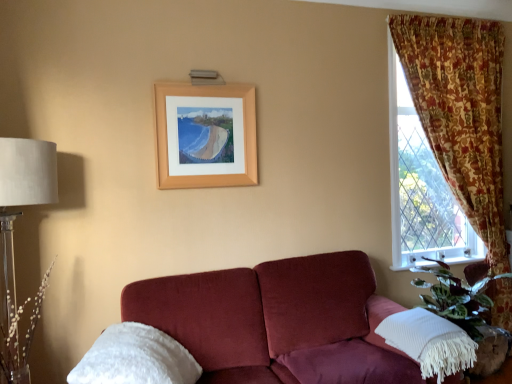
What is the approximate height of white textured pillow at lower right, arranged as the 2th pillow when viewed from the left?

It is 32.26 centimeters.

Locate an element on the screen. green leafy plant at lower right is located at coordinates (459, 294).

The width and height of the screenshot is (512, 384). Describe the element at coordinates (12, 237) in the screenshot. I see `translucent glass table lamp at left` at that location.

The width and height of the screenshot is (512, 384). What are the coordinates of `white textured pillow at lower right, arranged as the 2th pillow when viewed from the left` in the screenshot? It's located at (429, 342).

Is translucent glass table lamp at left beside green leafy plant at lower right?

No, translucent glass table lamp at left is not touching green leafy plant at lower right.

How many degrees apart are the facing directions of translucent glass table lamp at left and green leafy plant at lower right?

The angular difference between translucent glass table lamp at left and green leafy plant at lower right is 3.39 degrees.

Between translucent glass table lamp at left and green leafy plant at lower right, which one has larger width?

Wider between the two is green leafy plant at lower right.

Between translucent glass table lamp at left and green leafy plant at lower right, which one appears on the left side from the viewer's perspective?

translucent glass table lamp at left is more to the left.

Which is closer to the camera, (129, 330) or (398, 263)?

Point (129, 330) appears to be closer to the viewer than point (398, 263).

Is white fluffy pillow at lower left, which appears as the 1th pillow when viewed from the left, not inside white plastic at lower right?

Indeed, white fluffy pillow at lower left, which appears as the 1th pillow when viewed from the left, is completely outside white plastic at lower right.

Considering the sizes of objects white fluffy pillow at lower left, marked as the 2th pillow in a right-to-left arrangement, and white plastic at lower right in the image provided, who is smaller, white fluffy pillow at lower left, marked as the 2th pillow in a right-to-left arrangement, or white plastic at lower right?

With smaller size is white plastic at lower right.

From the image's perspective, which one is positioned lower, white fluffy pillow at lower left, which appears as the 1th pillow when viewed from the left, or white plastic at lower right?

From the image's view, white fluffy pillow at lower left, which appears as the 1th pillow when viewed from the left, is below.

Is white plastic at lower right smaller than floral fabric curtain at right?

Yes.

Where is `window sill located behind the floral fabric curtain at right`? The height and width of the screenshot is (384, 512). window sill located behind the floral fabric curtain at right is located at coordinates (437, 257).

Is white plastic at lower right closer to the viewer compared to floral fabric curtain at right?

No, white plastic at lower right is further to the viewer.

Does white plastic at lower right have a lesser width compared to floral fabric curtain at right?

Yes, white plastic at lower right is thinner than floral fabric curtain at right.

Who is bigger, translucent glass table lamp at left or white textured pillow at lower right, acting as the 1th pillow starting from the right?

Bigger between the two is translucent glass table lamp at left.

From a real-world perspective, between translucent glass table lamp at left and white textured pillow at lower right, arranged as the 2th pillow when viewed from the left, who is vertically higher?

translucent glass table lamp at left, from a real-world perspective.

Is translucent glass table lamp at left surrounding white textured pillow at lower right, arranged as the 2th pillow when viewed from the left?

No, white textured pillow at lower right, arranged as the 2th pillow when viewed from the left, is not surrounded by translucent glass table lamp at left.

Is translucent glass table lamp at left beside white textured pillow at lower right, acting as the 1th pillow starting from the right?

translucent glass table lamp at left and white textured pillow at lower right, acting as the 1th pillow starting from the right, are not in contact.

From a real-world perspective, is white fluffy pillow at lower left, marked as the 2th pillow in a right-to-left arrangement, positioned above or below green leafy plant at lower right?

white fluffy pillow at lower left, marked as the 2th pillow in a right-to-left arrangement, is above green leafy plant at lower right.

In the scene shown: Is white fluffy pillow at lower left, which appears as the 1th pillow when viewed from the left, located outside green leafy plant at lower right?

Indeed, white fluffy pillow at lower left, which appears as the 1th pillow when viewed from the left, is completely outside green leafy plant at lower right.

Is white fluffy pillow at lower left, marked as the 2th pillow in a right-to-left arrangement, to the left or to the right of green leafy plant at lower right in the image?

In the image, white fluffy pillow at lower left, marked as the 2th pillow in a right-to-left arrangement, appears on the left side of green leafy plant at lower right.

Is point (155, 341) closer to viewer compared to point (414, 280)?

Yes, it is.

Between wooden frame at upper center and green leafy plant at lower right, which one has larger size?

green leafy plant at lower right.

Considering the positions of objects wooden frame at upper center and green leafy plant at lower right in the image provided, who is more to the right, wooden frame at upper center or green leafy plant at lower right?

green leafy plant at lower right is more to the right.

In terms of width, does wooden frame at upper center look wider or thinner when compared to green leafy plant at lower right?

Considering their sizes, wooden frame at upper center looks slimmer than green leafy plant at lower right.

This screenshot has height=384, width=512. In order to click on picture frame that appears above the green leafy plant at lower right (from a real-world perspective) in this screenshot , I will do `click(233, 134)`.

Is white textured pillow at lower right, acting as the 1th pillow starting from the right, smaller than green leafy plant at lower right?

Correct, white textured pillow at lower right, acting as the 1th pillow starting from the right, occupies less space than green leafy plant at lower right.

From the image's perspective, relative to green leafy plant at lower right, is white textured pillow at lower right, acting as the 1th pillow starting from the right, above or below?

white textured pillow at lower right, acting as the 1th pillow starting from the right, is below green leafy plant at lower right.

Looking at their sizes, would you say white textured pillow at lower right, acting as the 1th pillow starting from the right, is wider or thinner than green leafy plant at lower right?

Considering their sizes, white textured pillow at lower right, acting as the 1th pillow starting from the right, looks slimmer than green leafy plant at lower right.

Is white textured pillow at lower right, arranged as the 2th pillow when viewed from the left, next to green leafy plant at lower right?

They are not placed beside each other.

The width and height of the screenshot is (512, 384). I want to click on plant that appears behind the translucent glass table lamp at left, so click(x=459, y=294).

Identify the location of window sill lying above the white fluffy pillow at lower left, which appears as the 1th pillow when viewed from the left (from the image's perspective). This screenshot has height=384, width=512. (437, 257).

Looking at the image, which one is located further to white plastic at lower right, green leafy plant at lower right or wooden frame at upper center?

wooden frame at upper center is further to white plastic at lower right.

Which object lies nearer to the anchor point translucent glass table lamp at left, white textured pillow at lower right, acting as the 1th pillow starting from the right, or white plastic at lower right?

The object closer to translucent glass table lamp at left is white textured pillow at lower right, acting as the 1th pillow starting from the right.

Estimate the real-world distances between objects in this image. Which object is further from white textured pillow at lower right, arranged as the 2th pillow when viewed from the left, white plastic at lower right or green leafy plant at lower right?

Among the two, white plastic at lower right is located further to white textured pillow at lower right, arranged as the 2th pillow when viewed from the left.

From the image, which object appears to be farther from floral fabric curtain at right, white plastic at lower right or white textured pillow at lower right, acting as the 1th pillow starting from the right?

Based on the image, white textured pillow at lower right, acting as the 1th pillow starting from the right, appears to be further to floral fabric curtain at right.

Estimate the real-world distances between objects in this image. Which object is closer to white plastic at lower right, white textured pillow at lower right, arranged as the 2th pillow when viewed from the left, or floral fabric curtain at right?

white textured pillow at lower right, arranged as the 2th pillow when viewed from the left, is positioned closer to the anchor white plastic at lower right.

From the image, which object appears to be farther from white textured pillow at lower right, arranged as the 2th pillow when viewed from the left, wooden frame at upper center or white plastic at lower right?

wooden frame at upper center is positioned further to the anchor white textured pillow at lower right, arranged as the 2th pillow when viewed from the left.

When comparing their distances from wooden frame at upper center, does white plastic at lower right or white fluffy pillow at lower left, which appears as the 1th pillow when viewed from the left, seem closer?

white fluffy pillow at lower left, which appears as the 1th pillow when viewed from the left, is closer to wooden frame at upper center.

From the image, which object appears to be farther from green leafy plant at lower right, floral fabric curtain at right or translucent glass table lamp at left?

Among the two, translucent glass table lamp at left is located further to green leafy plant at lower right.

Find the location of a particular element. pillow situated between wooden frame at upper center and white plastic at lower right from left to right is located at coordinates (429, 342).

Image resolution: width=512 pixels, height=384 pixels. In order to click on picture frame between white fluffy pillow at lower left, which appears as the 1th pillow when viewed from the left, and floral fabric curtain at right from left to right in this screenshot , I will do `click(233, 134)`.

Find the location of `plant located between white fluffy pillow at lower left, marked as the 2th pillow in a right-to-left arrangement, and white plastic at lower right in the left-right direction`. plant located between white fluffy pillow at lower left, marked as the 2th pillow in a right-to-left arrangement, and white plastic at lower right in the left-right direction is located at coordinates (459, 294).

The image size is (512, 384). In order to click on picture frame between translucent glass table lamp at left and white textured pillow at lower right, acting as the 1th pillow starting from the right in this screenshot , I will do `click(233, 134)`.